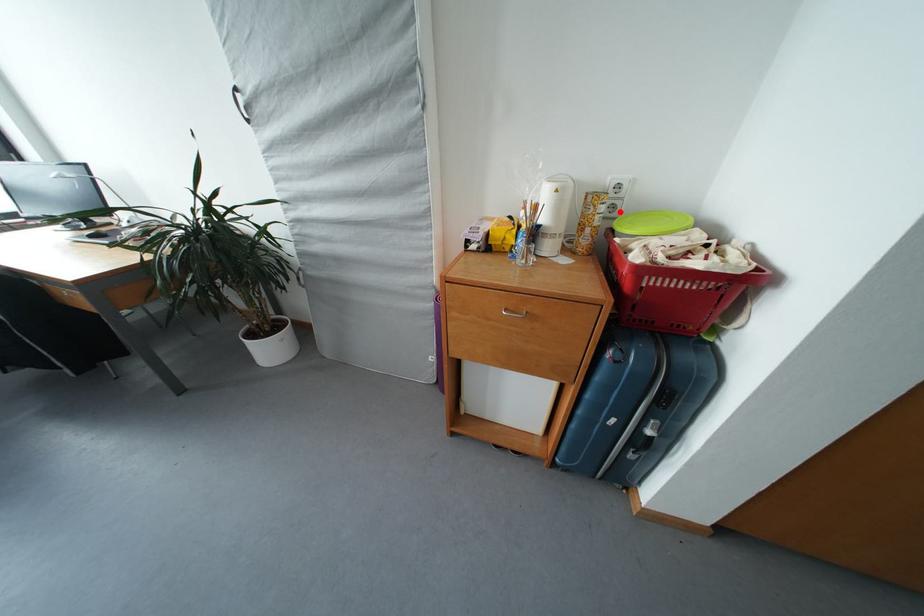
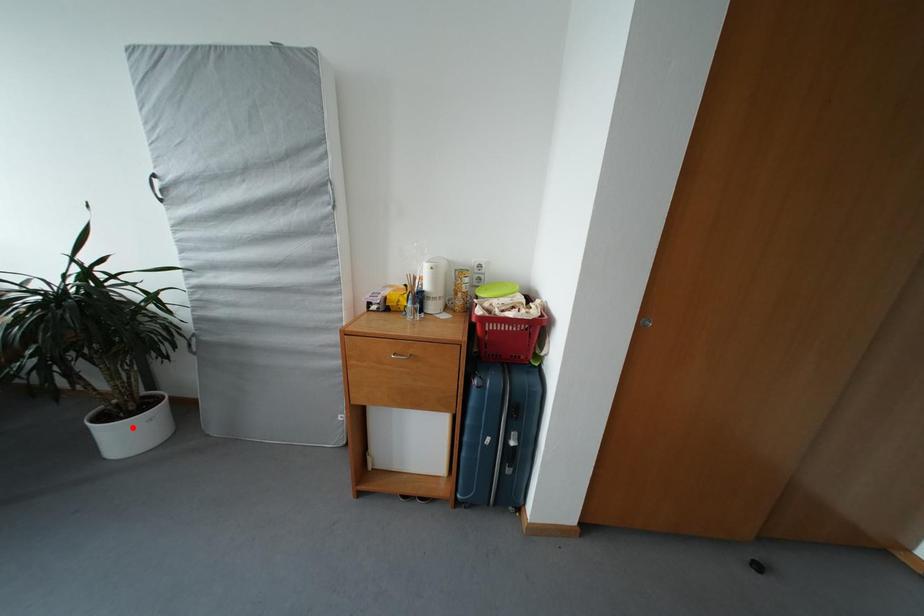
I am providing you with two images of the same scene from different viewpoints. A red point is marked on the first image and another point is marked on the second image. Do the highlighted points in image1 and image2 indicate the same real-world spot?

No